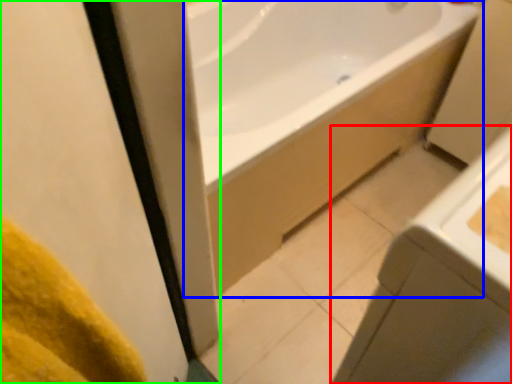
Question: Which object is positioned farthest from sink (highlighted by a red box)? Select from bathtub (highlighted by a blue box) and screen door (highlighted by a green box).

Choices:
 (A) bathtub
 (B) screen door

Answer: (A)